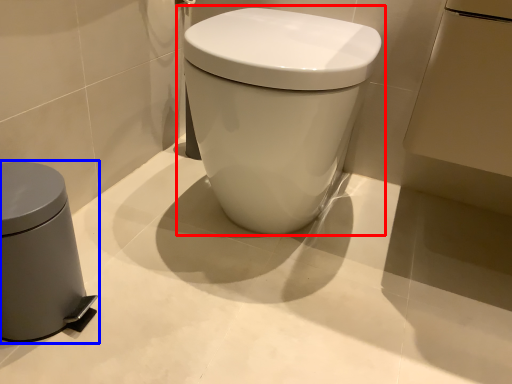
Question: Which object appears closest to the camera in this image, toilet (highlighted by a red box) or waste container (highlighted by a blue box)?

Choices:
 (A) toilet
 (B) waste container

Answer: (B)